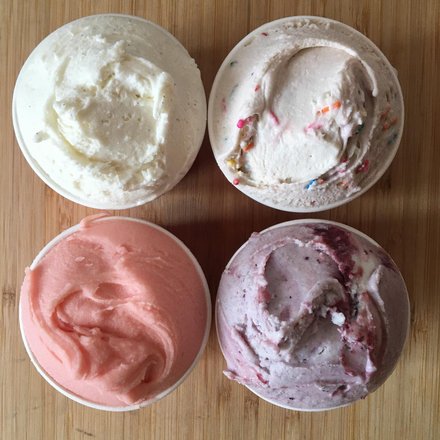
Find the location of a particular element. table space bottom center of bowls is located at coordinates (219, 418).